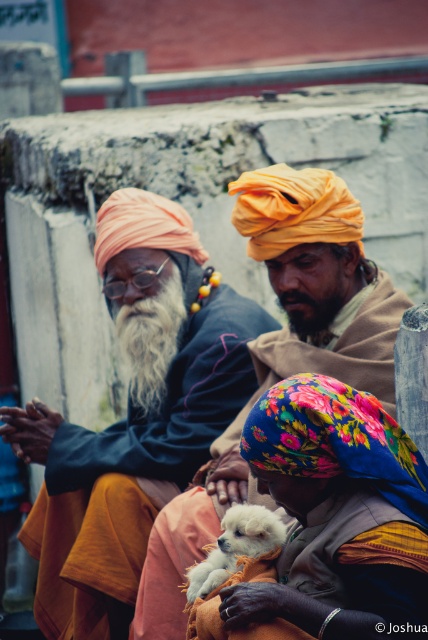
You are a photographer standing in front of the three people in the scene. You want to take a photo that includes both the matte orange turban at left and the orange turbaned man at center. Which one should you focus on first to ensure both are in focus?

You should focus on the matte orange turban at left first because it is closer to you than the orange turbaned man at center, so focusing on the closer object will help both be in focus.

You are a photographer trying to capture a clear photo of the whitefluffybeard at center and the white fluffy dog at center. Which one is blocking the view of the other?

The whitefluffybeard at center is positioned over white fluffy dog at center, so it is blocking the view of the white fluffy dog at center.

You are a photographer trying to capture a group photo of the orange turbaned man at center and the gray matte beard at center. Since you want to ensure both are visible, which person should you position closer to the camera to avoid being blocked by the other?

The gray matte beard at center should be positioned closer to the camera because the orange turbaned man at center is taller. This way, the shorter gray matte beard at center won